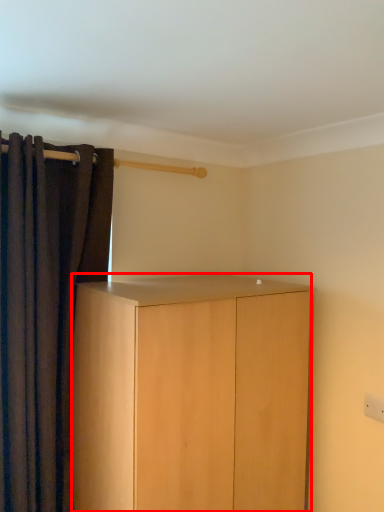
Question: From the image's perspective, what is the correct spatial positioning of cabinetry (annotated by the red box) in reference to curtain?

Choices:
 (A) below
 (B) above

Answer: (A)